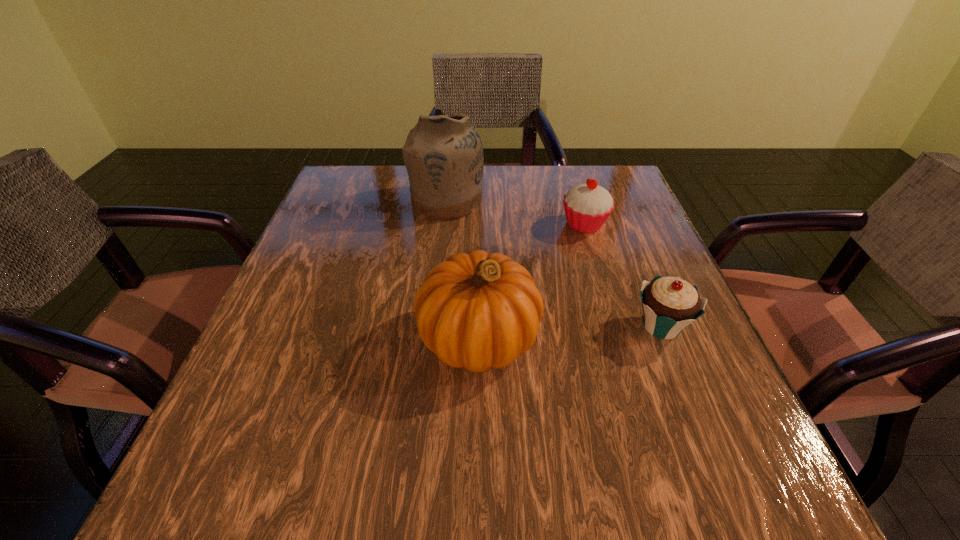
Find the location of a particular element. the tallest object is located at coordinates (443, 155).

At what (x,y) coordinates should I click in order to perform the action: click on pumpkin. Please return your answer as a coordinate pair (x, y). Image resolution: width=960 pixels, height=540 pixels. Looking at the image, I should click on (478, 310).

At what (x,y) coordinates should I click in order to perform the action: click on the farther cupcake. Please return your answer as a coordinate pair (x, y). The height and width of the screenshot is (540, 960). Looking at the image, I should click on (587, 206).

Identify the location of the nearer cupcake. (670, 304).

The height and width of the screenshot is (540, 960). Find the location of `free region located on the front of the tallest object`. free region located on the front of the tallest object is located at coordinates (441, 260).

Find the location of `free space located on the right of the pumpkin`. free space located on the right of the pumpkin is located at coordinates (614, 338).

Where is `blank space located on the back of the farther cupcake`? blank space located on the back of the farther cupcake is located at coordinates (576, 195).

In order to click on vacant region located on the back of the nearer cupcake in this screenshot , I will do `click(610, 198)`.

Find the location of a particular element. pottery that is at the far edge is located at coordinates (443, 155).

This screenshot has height=540, width=960. I want to click on cupcake that is at the far edge, so (587, 206).